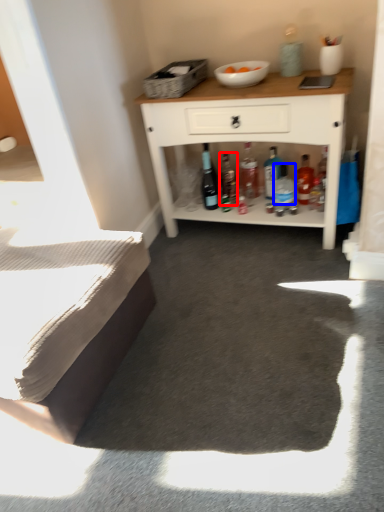
Question: Which object appears closest to the camera in this image, bottle (highlighted by a red box) or bottle (highlighted by a blue box)?

Choices:
 (A) bottle
 (B) bottle

Answer: (B)